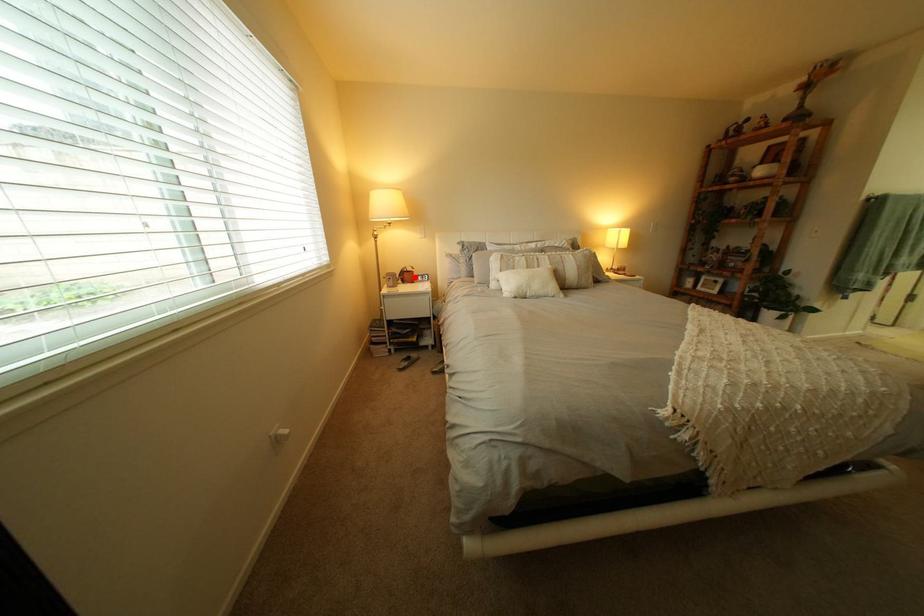
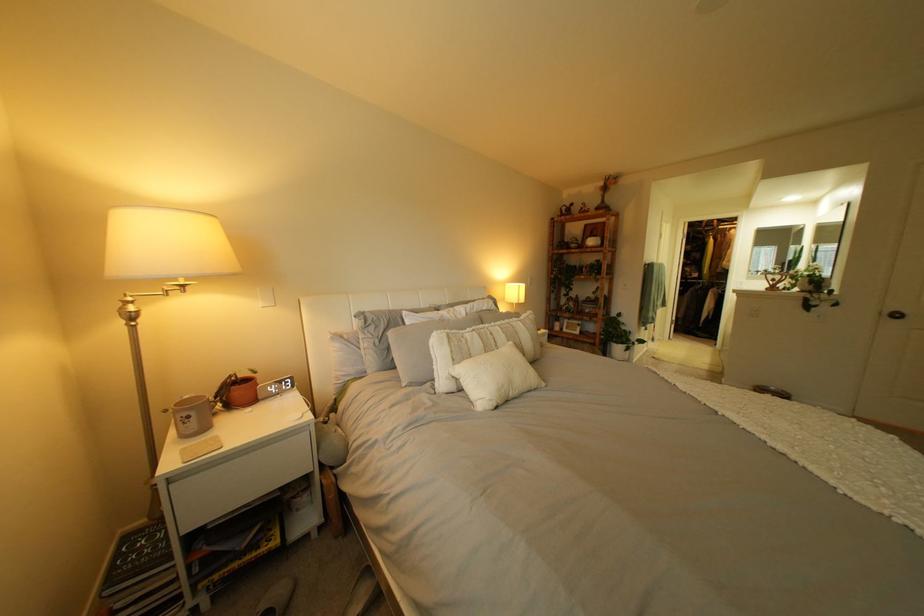
Locate, in the second image, the point that corresponds to the highlighted location in the first image.

(232, 399)